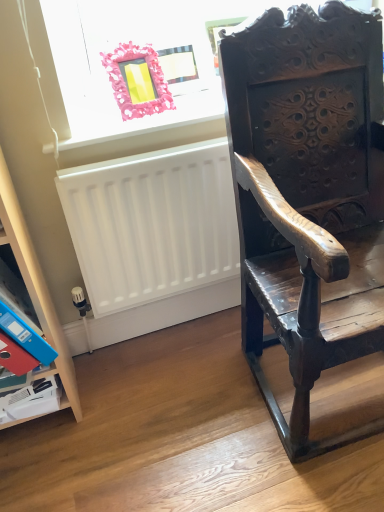
This screenshot has height=512, width=384. Identify the location of vacant region to the left of dark wood carved chair at right. (181, 414).